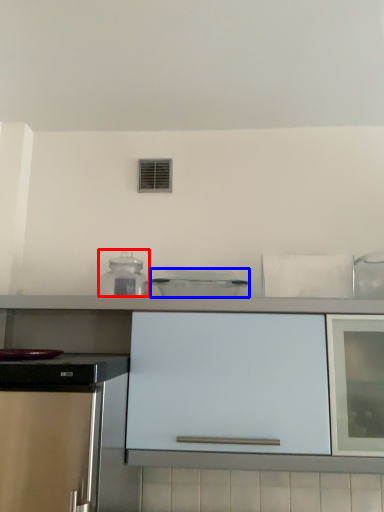
Question: Which of the following is the farthest to the observer, kitchen appliance (highlighted by a red box) or kitchen appliance (highlighted by a blue box)?

Choices:
 (A) kitchen appliance
 (B) kitchen appliance

Answer: (A)